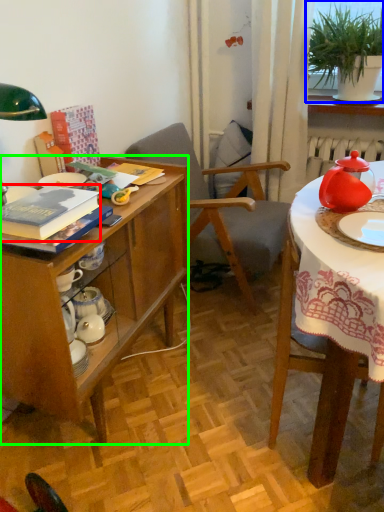
Question: Considering the real-world distances, which object is farthest from book (highlighted by a red box)? houseplant (highlighted by a blue box) or desk (highlighted by a green box)?

Choices:
 (A) houseplant
 (B) desk

Answer: (A)